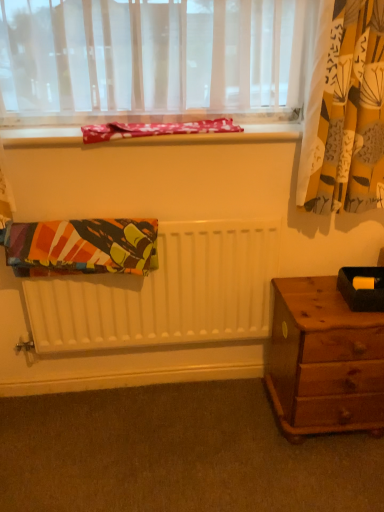
This screenshot has height=512, width=384. Find the location of `free point above carpet at lower center (from a real-world perspective)`. free point above carpet at lower center (from a real-world perspective) is located at coordinates (158, 438).